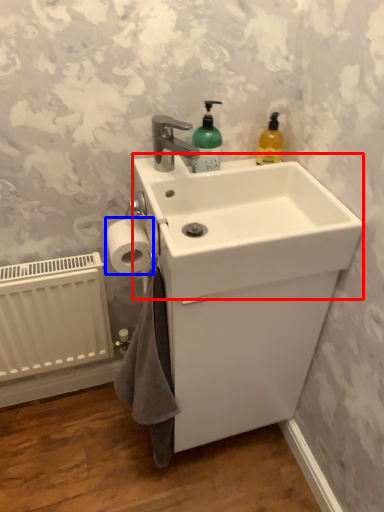
Question: Which object appears farthest to the camera in this image, counter top (highlighted by a red box) or toilet paper (highlighted by a blue box)?

Choices:
 (A) counter top
 (B) toilet paper

Answer: (B)